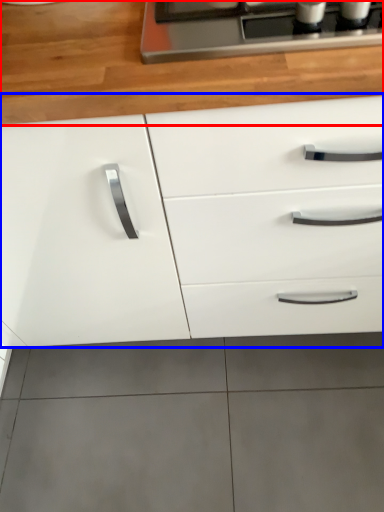
Question: Which point is further to the camera, countertop (highlighted by a red box) or cabinetry (highlighted by a blue box)?

Choices:
 (A) countertop
 (B) cabinetry

Answer: (A)